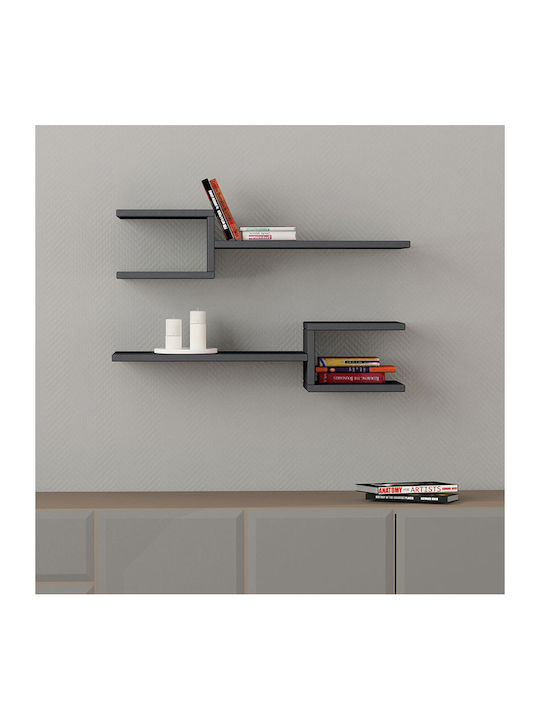
Identify the location of number of books. Image resolution: width=540 pixels, height=720 pixels. (404, 503), (406, 487), (367, 377), (375, 366), (341, 360), (258, 225), (261, 237), (227, 212), (224, 222).